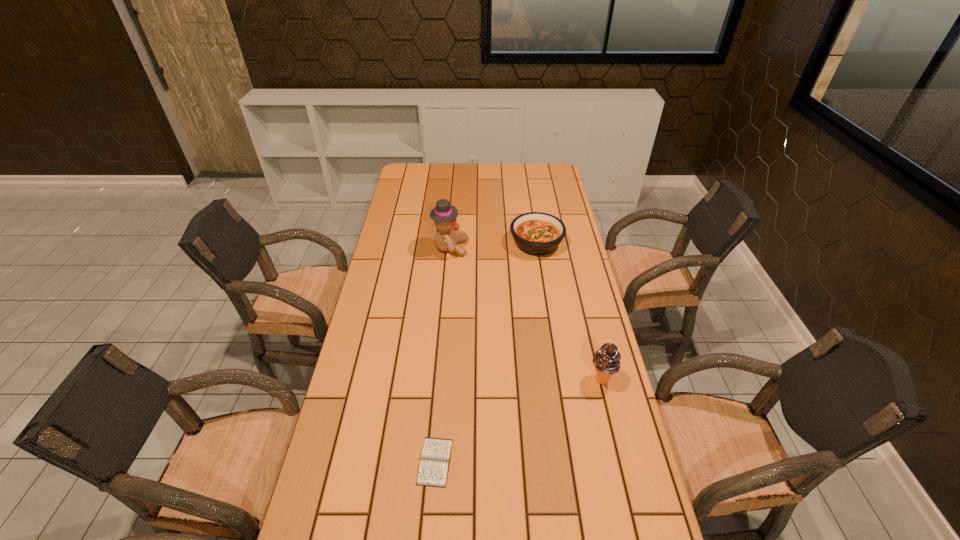
The width and height of the screenshot is (960, 540). I want to click on icecream that is positioned at the right edge, so click(606, 360).

Identify the location of stew located at the right edge. (535, 233).

In the image, there is a desktop. Where is `free space at the far edge`? The image size is (960, 540). free space at the far edge is located at coordinates (467, 167).

In order to click on free space at the left edge of the desktop in this screenshot , I will do `click(397, 228)`.

Image resolution: width=960 pixels, height=540 pixels. I want to click on vacant region at the right edge of the desktop, so click(613, 534).

At what (x,y) coordinates should I click in order to perform the action: click on blank space at the far right corner of the desktop. Please return your answer as a coordinate pair (x, y). Looking at the image, I should click on (533, 171).

This screenshot has width=960, height=540. I want to click on free spot between the rag_doll and the second shortest object, so click(493, 245).

Where is `free space between the diary and the rag_doll`? free space between the diary and the rag_doll is located at coordinates (443, 355).

Find the location of a particular element. empty space between the tallest object and the third tallest object is located at coordinates (493, 245).

The height and width of the screenshot is (540, 960). Identify the location of unoccupied position between the shortest object and the stew. (486, 353).